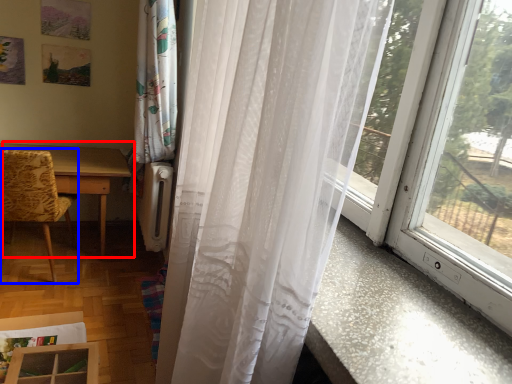
Question: Among these objects, which one is farthest to the camera, table (highlighted by a red box) or chair (highlighted by a blue box)?

Choices:
 (A) table
 (B) chair

Answer: (A)